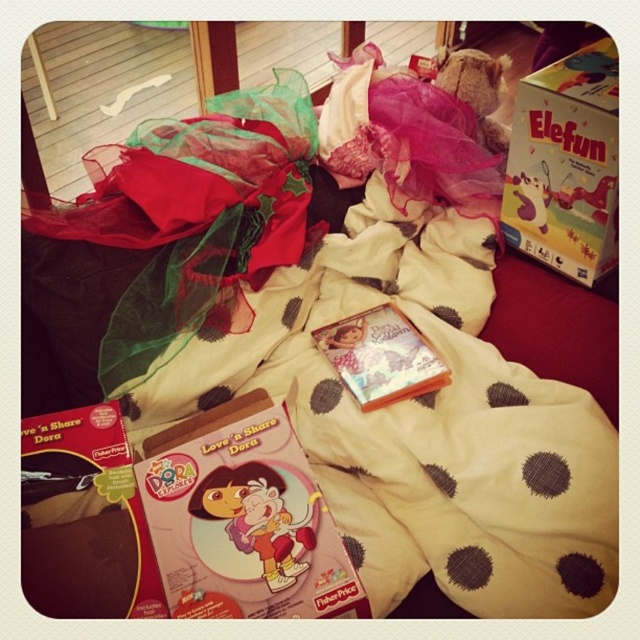
Question: Can you confirm if matte red book at center is positioned to the right of matte orange dvd case at center?

Choices:
 (A) no
 (B) yes

Answer: (A)

Question: Which object appears farthest from the camera in this image?

Choices:
 (A) matte orange dvd case at center
 (B) matte red book at center
 (C) matte cardboard box at center
 (D) matte cardboard box at upper right

Answer: (A)

Question: Considering the relative positions of matte red book at center and matte cardboard box at center in the image provided, where is matte red book at center located with respect to matte cardboard box at center?

Choices:
 (A) above
 (B) below

Answer: (A)

Question: Can you confirm if matte red book at center is positioned to the left of matte orange dvd case at center?

Choices:
 (A) yes
 (B) no

Answer: (A)

Question: Which point appears farthest from the camera in this image?

Choices:
 (A) (184, 458)
 (B) (532, 250)

Answer: (B)

Question: Which point is farther to the camera?

Choices:
 (A) matte orange dvd case at center
 (B) matte cardboard box at center
 (C) matte cardboard box at upper right
 (D) matte red book at center

Answer: (A)